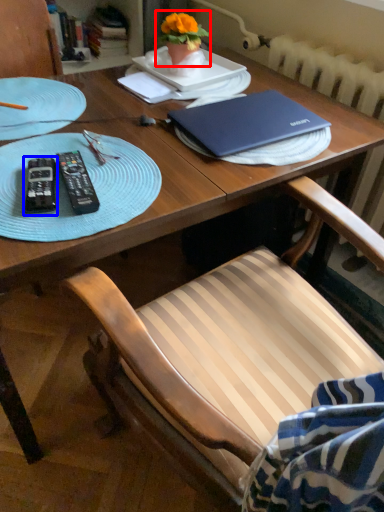
Question: Which object is further to the camera taking this photo, houseplant (highlighted by a red box) or remote control (highlighted by a blue box)?

Choices:
 (A) houseplant
 (B) remote control

Answer: (A)